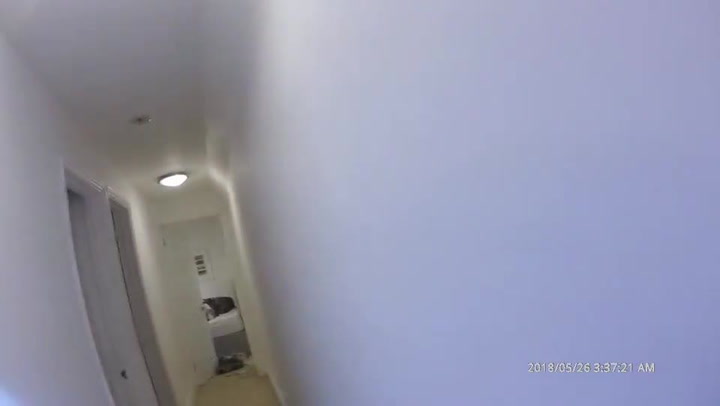
Locate an element on the screen. The image size is (720, 406). light is located at coordinates (181, 182).